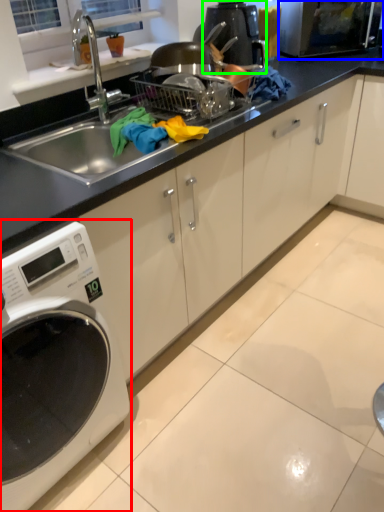
Question: Which is nearer to the home appliance (highlighted by a red box)? microwave oven (highlighted by a blue box) or coffee machine (highlighted by a green box).

Choices:
 (A) microwave oven
 (B) coffee machine

Answer: (B)